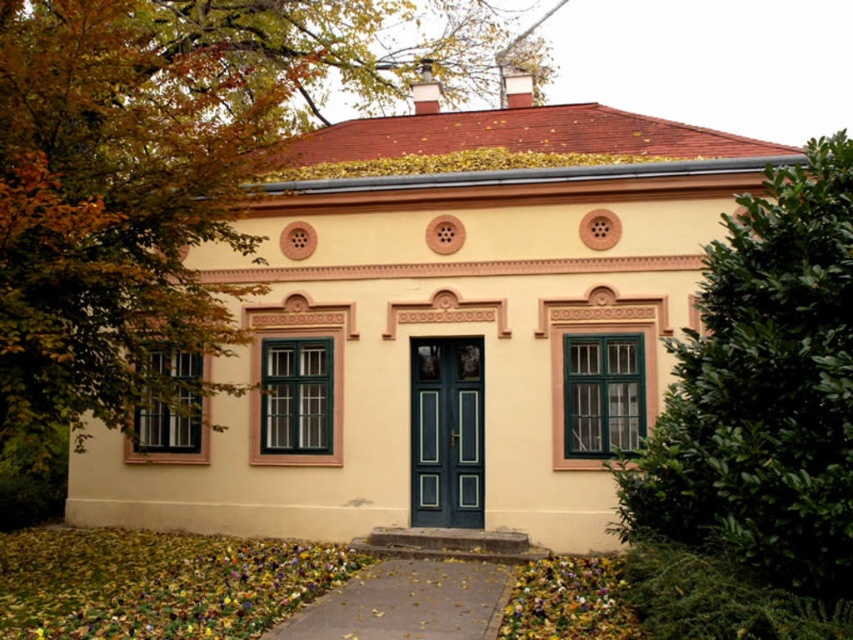
From the picture: You are standing in front of the building and want to see both the green leafy tree at left and the green leafy bush at right clearly. Which one is closer to you?

The green leafy tree at left is closer to you because the green leafy bush at right is behind it.

You are standing in front of the building and want to determine the relative positions of two points marked on its facade. The first point is at coordinates point (277, 40) and the second is at point (459, 397). Which point is closer to you?

Point (277, 40) is closer to you because it is further to the viewer than point (459, 397).

You are standing in front of the building and want to take a photo of the green leafy tree at left. Based on its position, where should you aim your camera relative to the building?

The green leafy tree at left is located at the coordinates 0.292 on the x axis and 0.163 on the y axis, so you should aim your camera to the left side of the building to capture it.